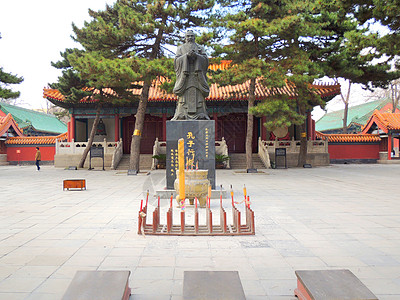
This screenshot has width=400, height=300. What are the coordinates of `statue` in the screenshot? It's located at (194, 54).